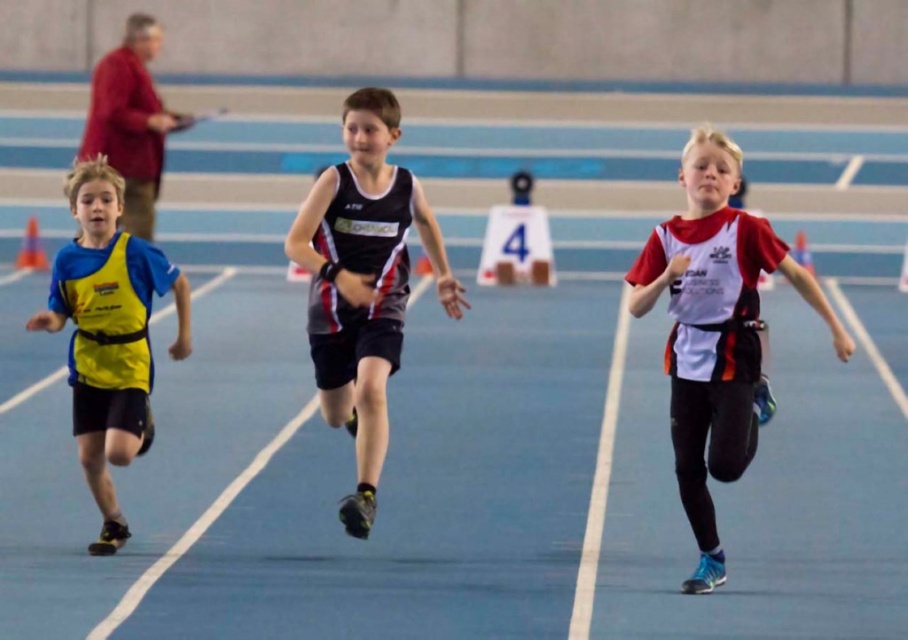
Question: Which point is closer to the camera?

Choices:
 (A) (679, 301)
 (B) (327, 224)
 (C) (110, 192)

Answer: (A)

Question: Among these points, which one is farthest from the camera?

Choices:
 (A) (107, 292)
 (B) (669, 310)
 (C) (354, 252)

Answer: (C)

Question: Does white matte jersey at center appear on the right side of yellow fabric vest at left?

Choices:
 (A) no
 (B) yes

Answer: (B)

Question: Is black matte running suit at center to the right of yellow fabric vest at left from the viewer's perspective?

Choices:
 (A) yes
 (B) no

Answer: (A)

Question: Among these points, which one is nearest to the camera?

Choices:
 (A) (112, 488)
 (B) (742, 353)
 (C) (302, 218)

Answer: (B)

Question: Is white matte jersey at center positioned behind black matte running suit at center?

Choices:
 (A) no
 (B) yes

Answer: (A)